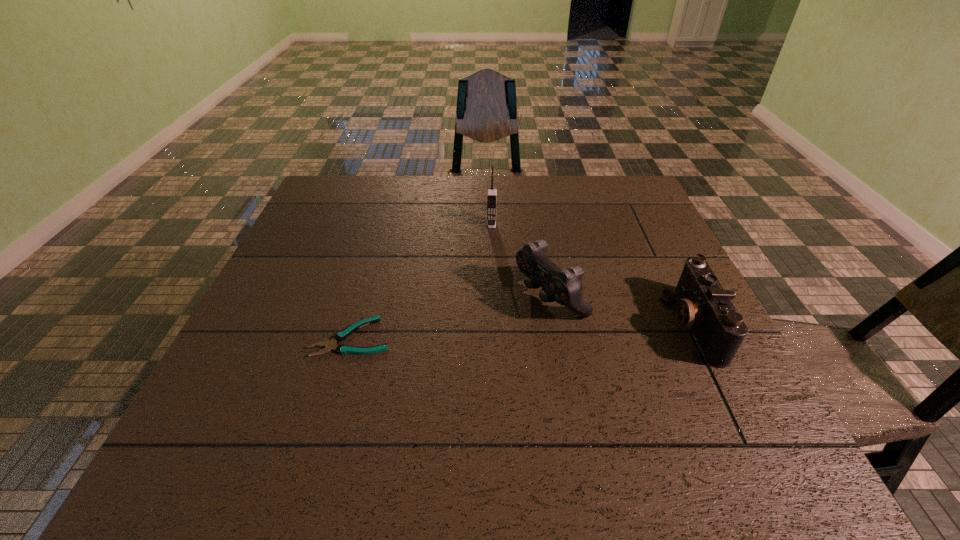
Find the location of a particular element. vacant space on the desktop that is between the shortest object and the camera and is positioned on the surface of the second object from right to left with buttons is located at coordinates (479, 333).

Where is `vacant spot on the desktop that is between the shortest object and the rightmost object and is positioned on the front-facing side of the cellular telephone`? This screenshot has width=960, height=540. vacant spot on the desktop that is between the shortest object and the rightmost object and is positioned on the front-facing side of the cellular telephone is located at coordinates (488, 332).